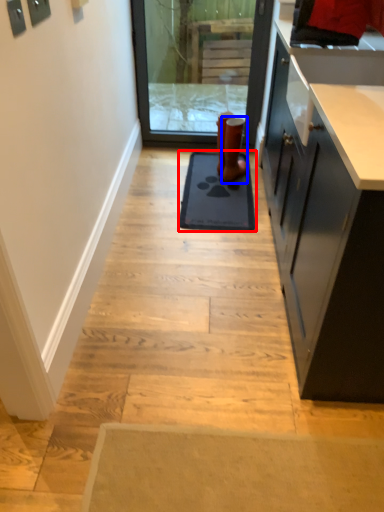
Question: Which object appears closest to the camera in this image, mat (highlighted by a red box) or footwear (highlighted by a blue box)?

Choices:
 (A) mat
 (B) footwear

Answer: (A)